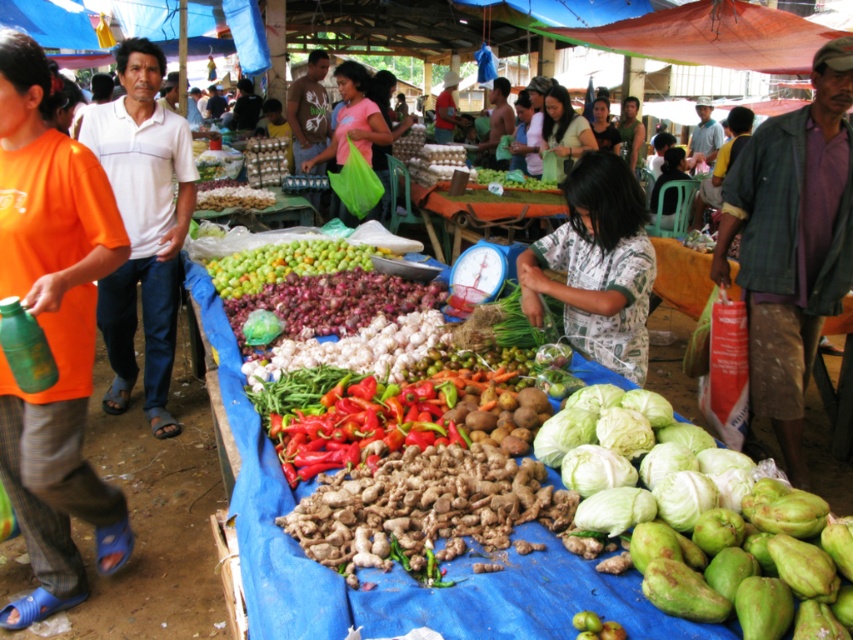
Question: Does green matte apples at center have a greater width compared to pink fabric bag at center?

Choices:
 (A) yes
 (B) no

Answer: (A)

Question: Does white printed shirt at center appear under pink fabric bag at center?

Choices:
 (A) yes
 (B) no

Answer: (A)

Question: Which object is the farthest from the matte green fabric at center?

Choices:
 (A) orange fabric shirt at left
 (B) matte black shirt at center
 (C) pink fabric bag at center

Answer: (A)

Question: Estimate the real-world distances between objects in this image. Which object is farther from the green matte apples at center?

Choices:
 (A) pink fabric bag at center
 (B) matte green fabric at center
 (C) green rough guava at center
 (D) white printed shirt at center

Answer: (B)

Question: Which point is farther to the camera?

Choices:
 (A) (262, 276)
 (B) (606, 134)
 (C) (90, 280)

Answer: (B)

Question: Is white printed shirt at center smaller than green matte apples at center?

Choices:
 (A) yes
 (B) no

Answer: (B)